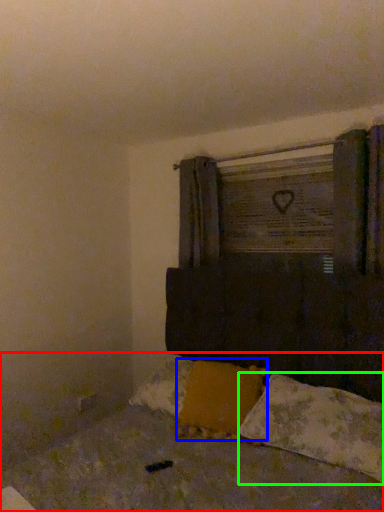
Question: Which object is positioned closest to bed (highlighted by a red box)? Select from pillow (highlighted by a blue box) and pillow (highlighted by a green box).

Choices:
 (A) pillow
 (B) pillow

Answer: (B)